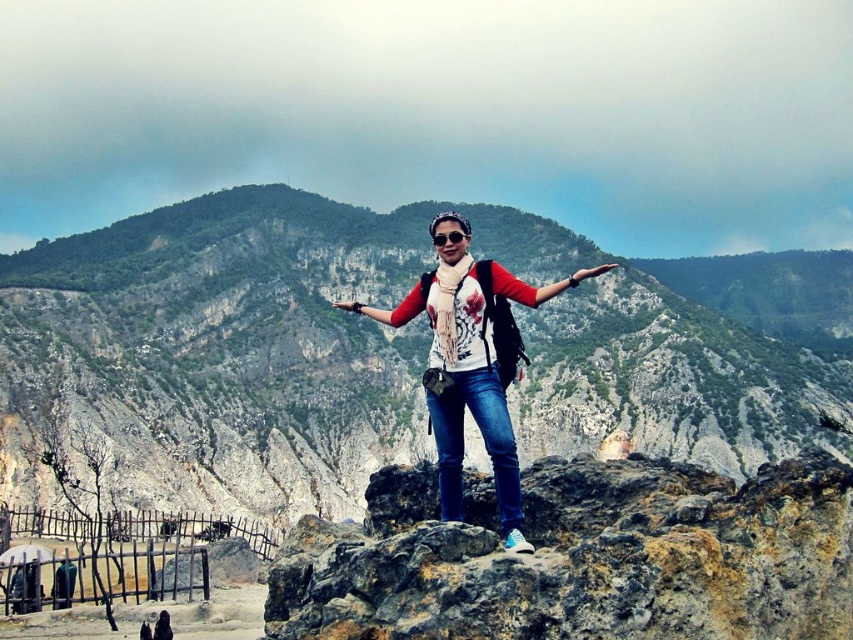
Consider the image. You are a hiker who wants to place a small flag on the highest point between the rocky terrain at center and the white printed shirt at center. Which location should you choose?

The rocky terrain at center is located above the white printed shirt at center, so you should place the flag on the rocky terrain at center as it is higher.

You are navigating a drone over a mountainous area and need to land it precisely on the rocky terrain at center. According to the coordinates provided, what are the exact coordinates where you should direct the drone to land?

The exact coordinates for the rocky terrain at center are point (230,346).

You are a photographer trying to capture the perfect shot of the white printed shirt at center and transparent plastic goggles at center. Since you want to ensure both are clearly visible, which object should you focus on first to avoid blurring due to their size difference?

You should focus on the white printed shirt at center first because it is larger than the transparent plastic goggles at center, making it easier to capture clearly before adjusting for the smaller object.